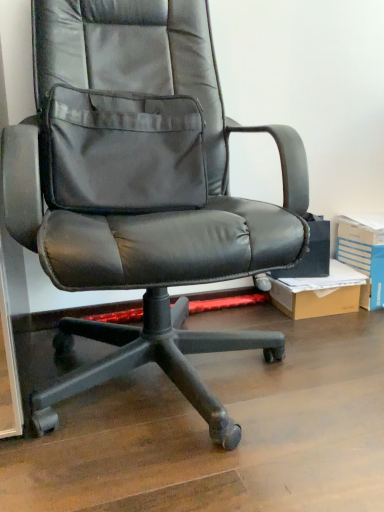
Question: Is blue cardboard box at right taller or shorter than brown cardboard box at lower right?

Choices:
 (A) short
 (B) tall

Answer: (B)

Question: Looking at the image, does blue cardboard box at right seem bigger or smaller compared to brown cardboard box at lower right?

Choices:
 (A) big
 (B) small

Answer: (A)

Question: Which is farther from the brown cardboard box at lower right?

Choices:
 (A) black leather office chair at center
 (B) blue cardboard box at right

Answer: (A)

Question: Considering the real-world distances, which object is farthest from the brown cardboard box at lower right?

Choices:
 (A) black leather office chair at center
 (B) blue cardboard box at right

Answer: (A)